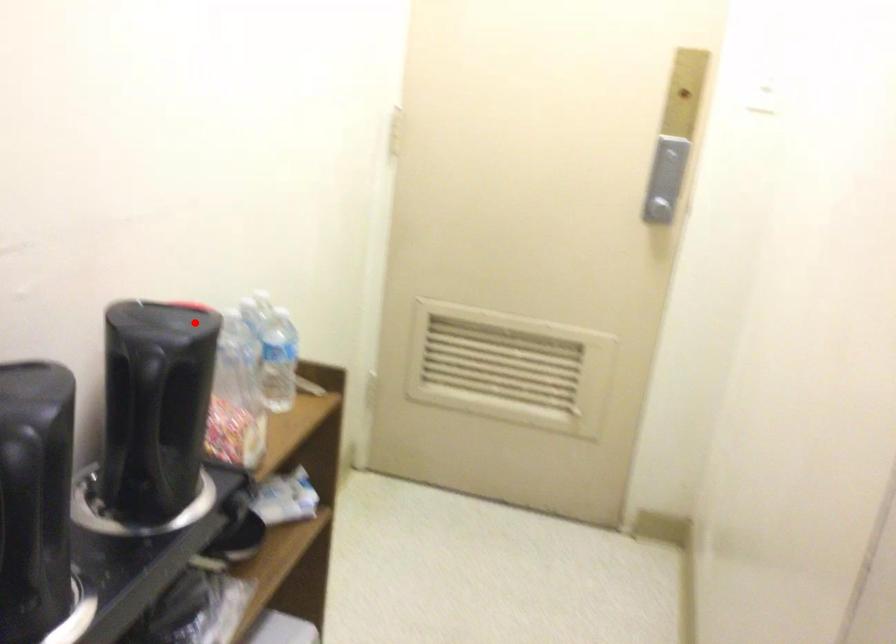
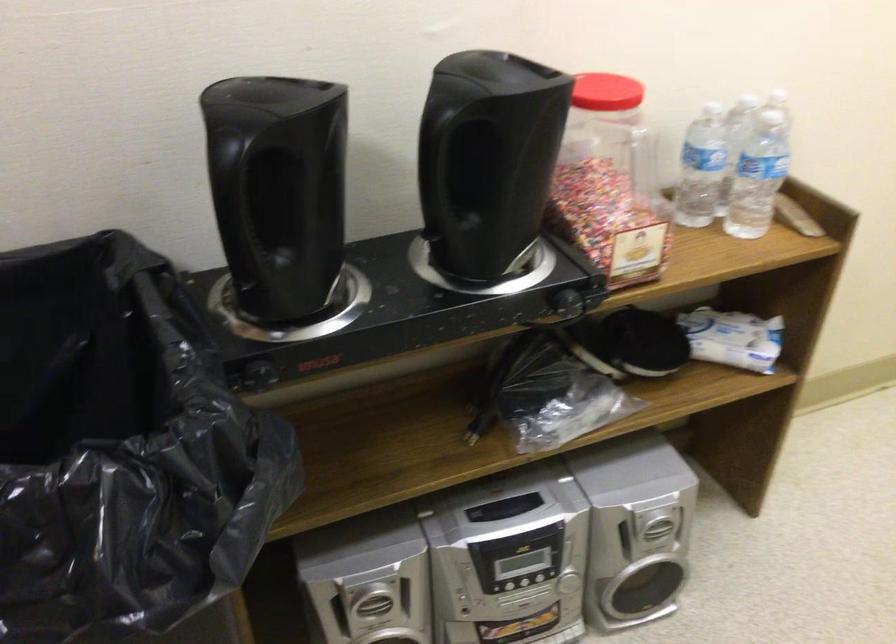
Question: I am providing you with two images of the same scene from different viewpoints. A red point is marked on the first image. At the location where the point appears in image 1, is it still visible in image 2?

Choices:
 (A) Yes
 (B) No

Answer: (A)